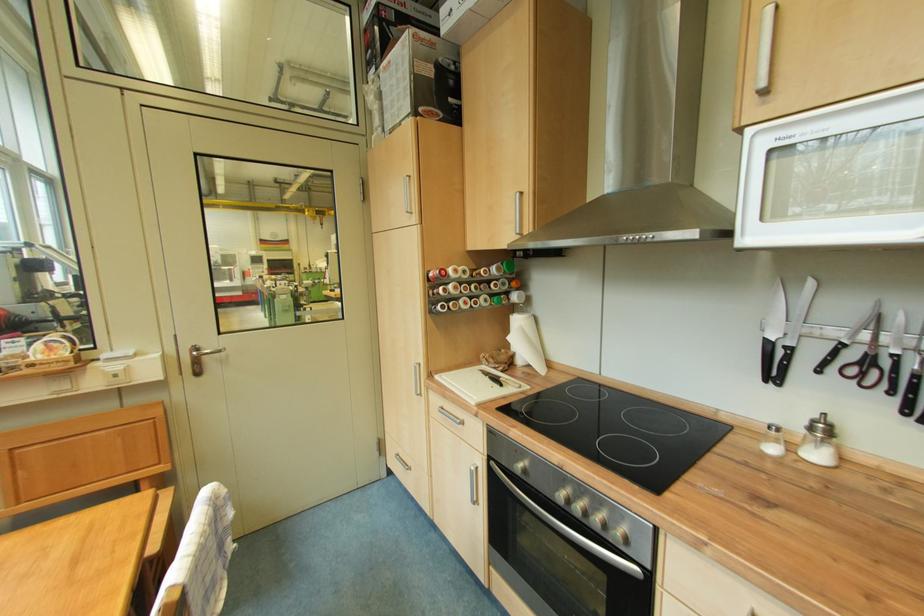
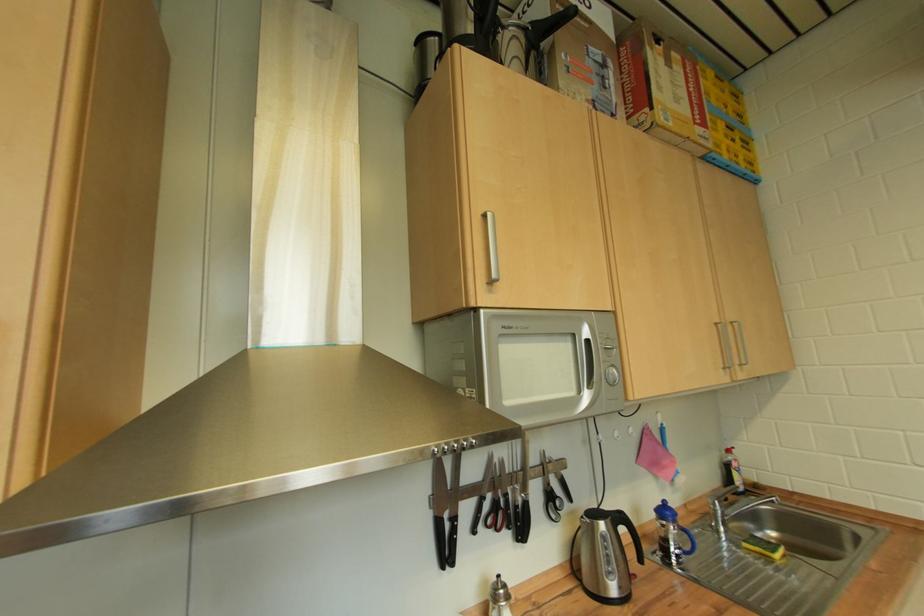
Question: The first image is from the beginning of the video and the second image is from the end. How did the camera likely rotate when shooting the video?

Choices:
 (A) Left
 (B) Right
 (C) Up
 (D) Down

Answer: (B)